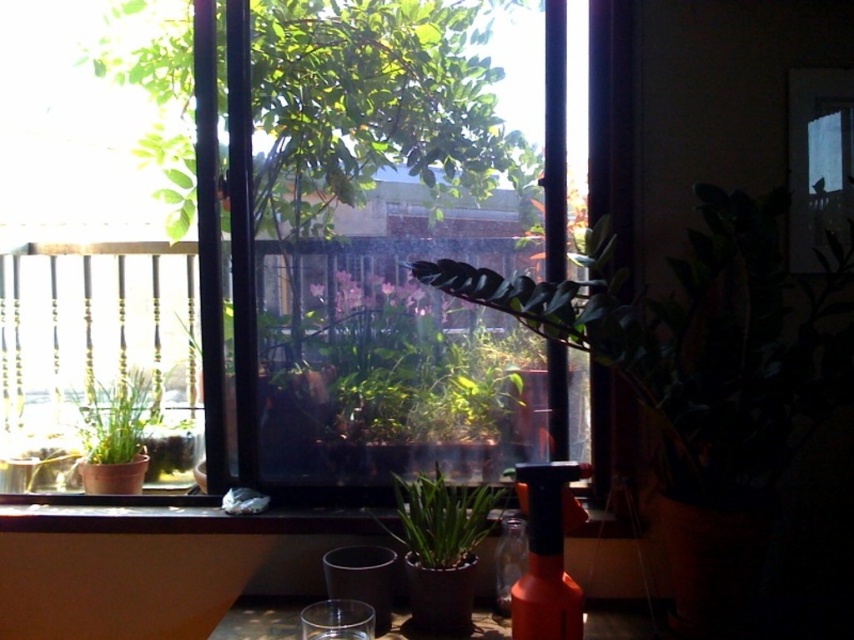
You are organizing a small indoor garden and have both the green matte leafy plant at center and the translucent glass bottle at center. Which object requires more space horizontally to accommodate its width?

The green matte leafy plant at center requires more horizontal space because its width surpasses that of the translucent glass bottle at center.